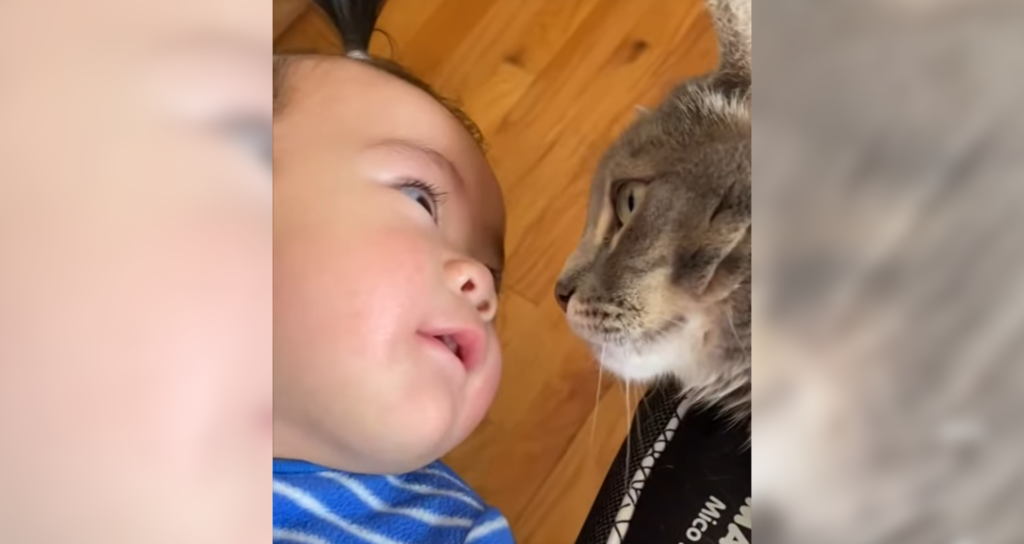
At what (x,y) coordinates should I click in order to perform the action: click on floor. Please return your answer as a coordinate pair (x, y). This screenshot has width=1024, height=544. Looking at the image, I should click on (548, 90).